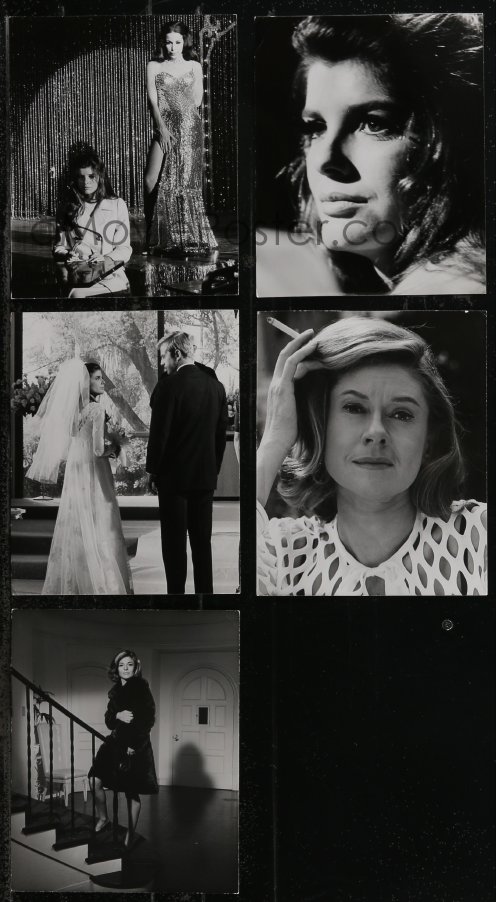
In order to click on hand rails in this screenshot , I will do `click(64, 710)`.